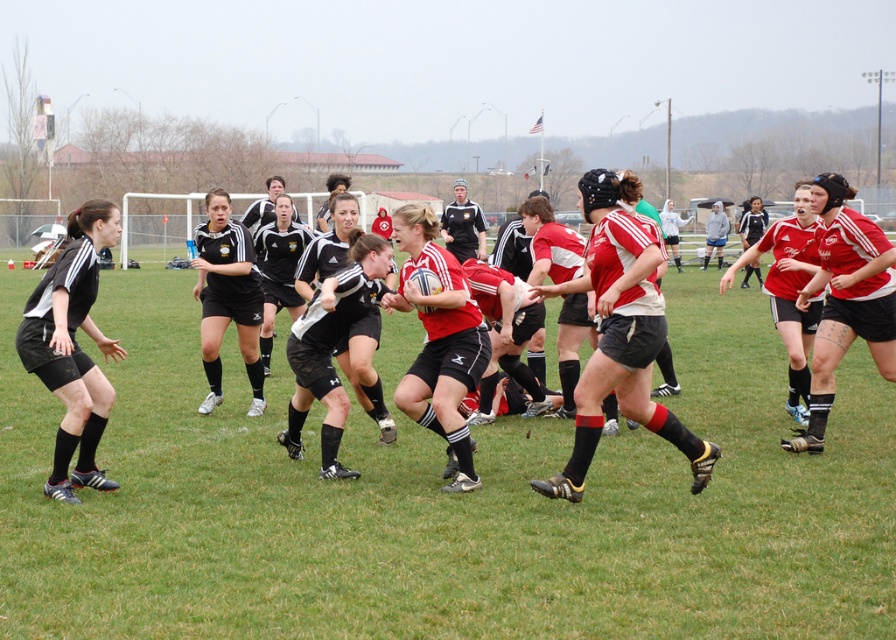
Who is more forward, (x=244, y=518) or (x=88, y=262)?

Point (x=244, y=518) is more forward.

Is point (102, 451) positioned behind point (104, 417)?

Yes, it is.

Find the location of `green grass football field at center`. green grass football field at center is located at coordinates (442, 500).